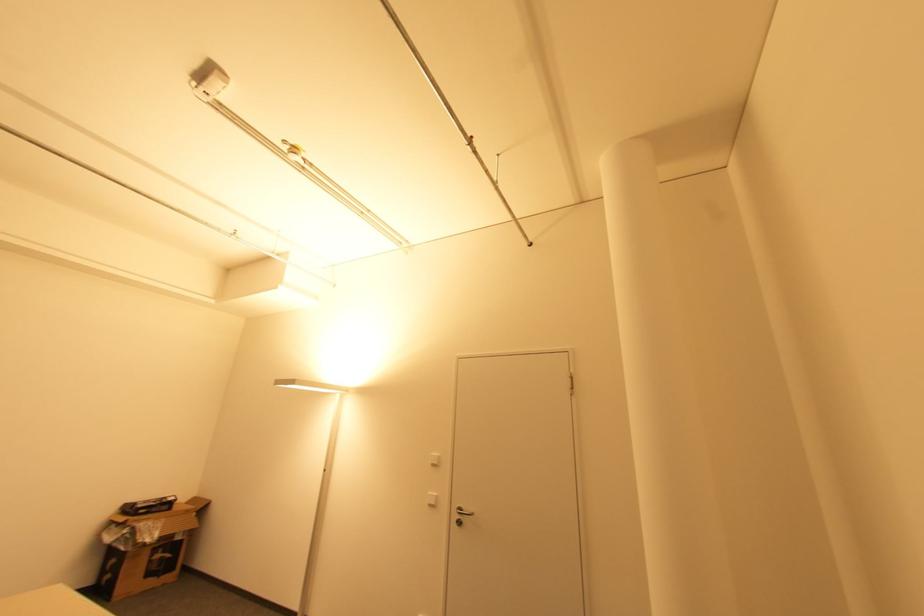
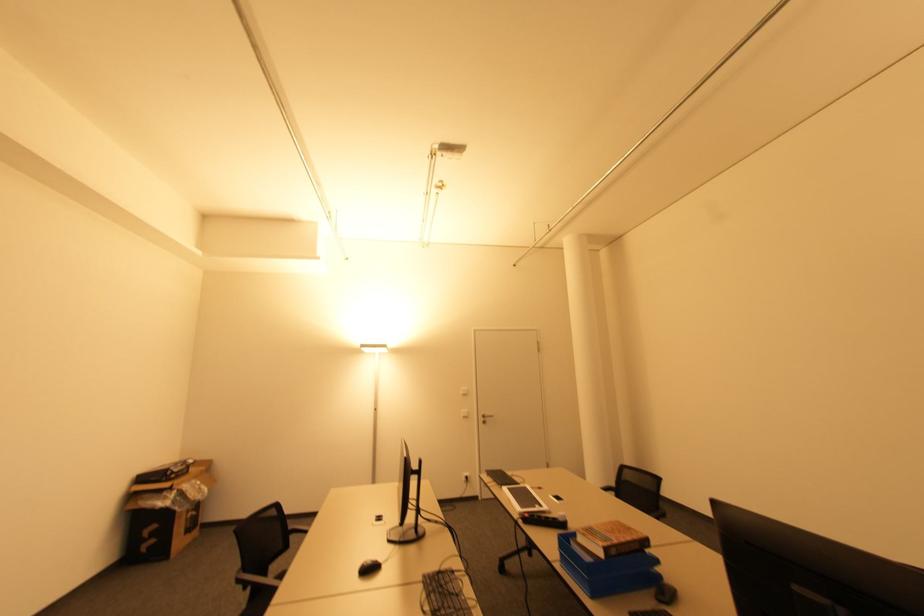
Locate, in the second image, the point that corresponds to (463,524) in the first image.

(485, 422)